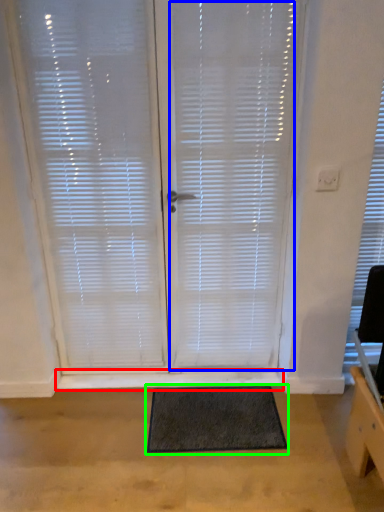
Question: Based on their relative distances, which object is farther from window sill (highlighted by a red box)? Choose from blind (highlighted by a blue box) and doormat (highlighted by a green box).

Choices:
 (A) blind
 (B) doormat

Answer: (A)